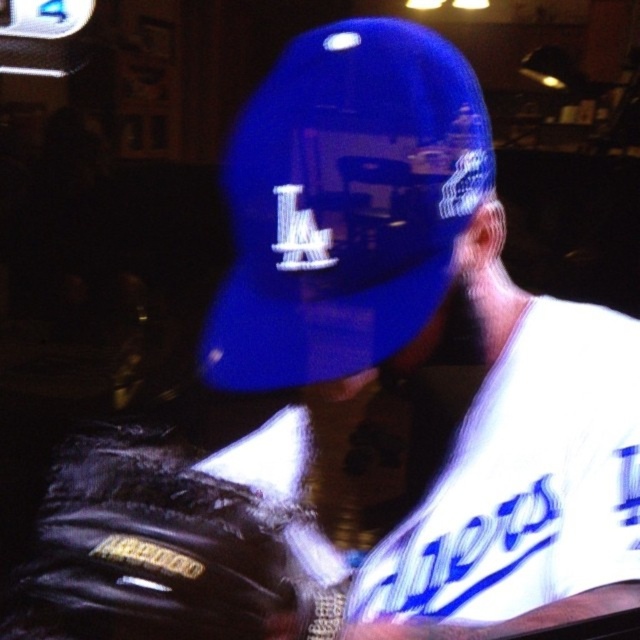
Which is more to the right, glossy blue baseball cap at center or white matte jersey at center?

white matte jersey at center is more to the right.

Which is behind, point (348, 160) or point (445, 621)?

Positioned behind is point (445, 621).

At what (x,y) coordinates should I click in order to perform the action: click on glossy blue baseball cap at center. Please return your answer as a coordinate pair (x, y). This screenshot has height=640, width=640. Looking at the image, I should click on (344, 204).

This screenshot has width=640, height=640. I want to click on glossy blue baseball cap at center, so click(344, 204).

Does glossy blue baseball cap at center have a greater width compared to black leather baseball glove at lower left?

Yes.

Does point (346, 244) come behind point (99, 582)?

Yes, point (346, 244) is farther from viewer.

This screenshot has width=640, height=640. I want to click on glossy blue baseball cap at center, so click(344, 204).

Who is more distant from viewer, (548, 381) or (248, 611)?

The point (548, 381) is more distant.

Which is above, white matte jersey at center or black leather baseball glove at lower left?

white matte jersey at center

Does point (540, 440) lie in front of point (236, 536)?

No, (540, 440) is further to viewer.

Locate an element on the screen. white matte jersey at center is located at coordinates (522, 486).